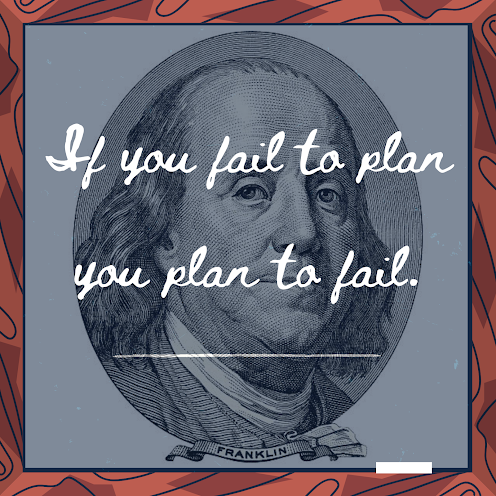
At what (x,y) coordinates should I click in order to perform the action: click on wooden frame. Please return your answer as a coordinate pair (x, y). This screenshot has width=496, height=496. Looking at the image, I should click on (97, 484).